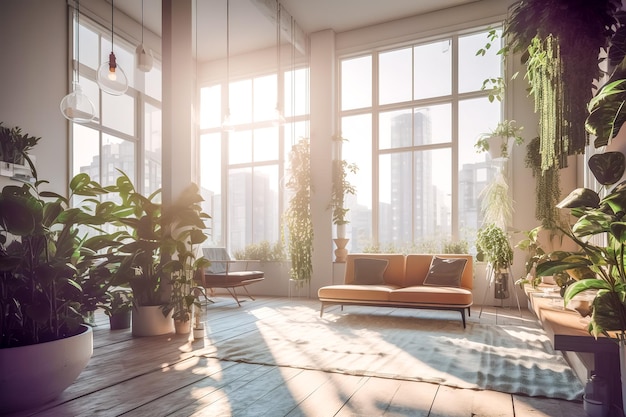
Locate an element on the screen. floor boards is located at coordinates (558, 404), (476, 413), (399, 405), (312, 392), (249, 386), (213, 380), (158, 379), (128, 364), (111, 348), (105, 338).